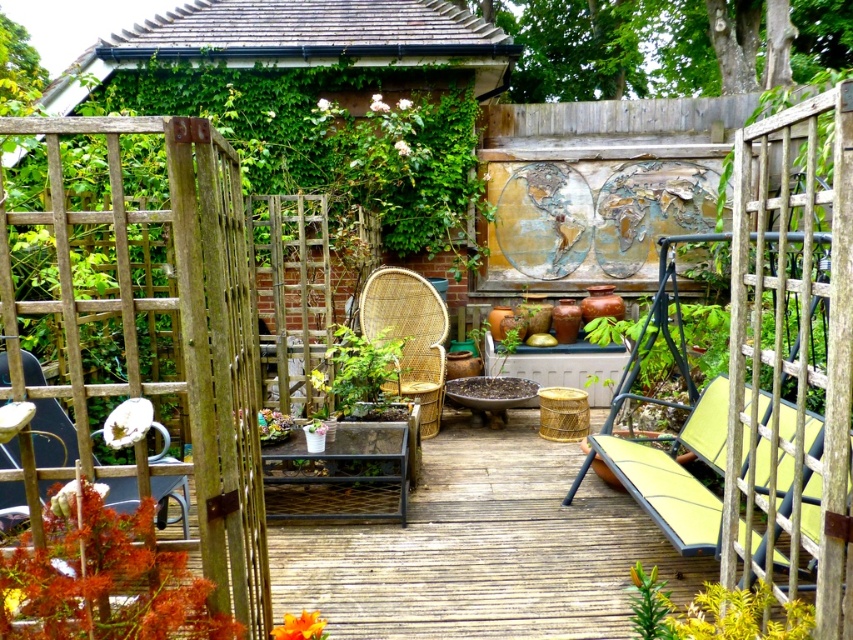
Question: Does orange leafy plant at lower left have a larger size compared to green leafy plant at lower right?

Choices:
 (A) yes
 (B) no

Answer: (B)

Question: Estimate the real-world distances between objects in this image. Which object is farther from the green leafy plant at center?

Choices:
 (A) orange leafy plant at lower left
 (B) wooden deck at center

Answer: (A)

Question: Is orange leafy plant at lower left wider than green leafy plant at center?

Choices:
 (A) yes
 (B) no

Answer: (B)

Question: Considering the relative positions of woven rattan chair at center and metallic silver chair at left in the image provided, where is woven rattan chair at center located with respect to metallic silver chair at left?

Choices:
 (A) above
 (B) below

Answer: (A)

Question: Which object appears farthest from the camera in this image?

Choices:
 (A) green leafy plant at center
 (B) wooden deck at center
 (C) orange leafy plant at lower left

Answer: (A)

Question: Which object is farther from the camera taking this photo?

Choices:
 (A) metallic silver chair at left
 (B) wooden deck at center
 (C) orange leafy plant at lower left
 (D) green leafy plant at lower right

Answer: (B)